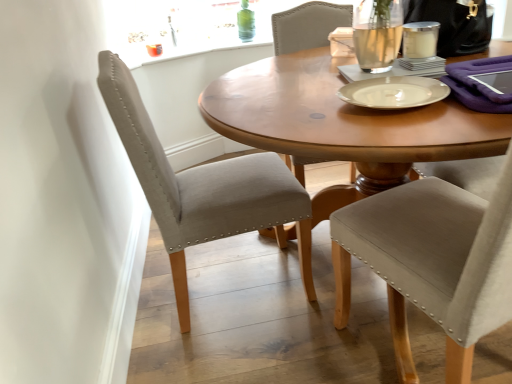
Question: Can we say white matte plate at center, placed as the first tableware when sorted from bottom to top, lies outside satin beige chair at left, which ranks as the 1th chair in left-to-right order?

Choices:
 (A) no
 (B) yes

Answer: (B)

Question: Is white matte plate at center, which ranks as the 2th tableware in top-to-bottom order, surrounding satin beige chair at left, which ranks as the 1th chair in left-to-right order?

Choices:
 (A) no
 (B) yes

Answer: (A)

Question: Is white matte plate at center, the first tableware viewed from the left, shorter than satin beige chair at left, the second chair viewed from the right?

Choices:
 (A) yes
 (B) no

Answer: (A)

Question: Can you confirm if white matte plate at center, placed as the first tableware when sorted from bottom to top, is wider than satin beige chair at left, the second chair viewed from the right?

Choices:
 (A) yes
 (B) no

Answer: (B)

Question: Considering the relative sizes of white matte plate at center, which is the second tableware from right to left, and satin beige chair at left, which ranks as the 1th chair in left-to-right order, in the image provided, is white matte plate at center, which is the second tableware from right to left, taller than satin beige chair at left, which ranks as the 1th chair in left-to-right order,?

Choices:
 (A) no
 (B) yes

Answer: (A)

Question: Is white matte plate at center, which is the second tableware in back-to-front order, bigger or smaller than satin beige chair at left, which ranks as the 1th chair in left-to-right order?

Choices:
 (A) big
 (B) small

Answer: (B)

Question: Is white matte plate at center, which is the second tableware from right to left, to the left or to the right of satin beige chair at left, the second chair viewed from the right, in the image?

Choices:
 (A) right
 (B) left

Answer: (A)

Question: Is white matte plate at center, placed as the first tableware when sorted from bottom to top, situated inside satin beige chair at left, which ranks as the 1th chair in left-to-right order, or outside?

Choices:
 (A) inside
 (B) outside

Answer: (B)

Question: Is white matte plate at center, the first tableware viewed from the left, wider or thinner than satin beige chair at left, the second chair viewed from the right?

Choices:
 (A) thin
 (B) wide

Answer: (A)

Question: Is point (403, 44) closer or farther from the camera than point (412, 104)?

Choices:
 (A) farther
 (B) closer

Answer: (A)

Question: From the image's perspective, is clear glass candle at upper right, the 1th tableware from the right, located above or below white matte plate at center, which is the second tableware from right to left?

Choices:
 (A) above
 (B) below

Answer: (A)

Question: Considering their positions, is clear glass candle at upper right, the first tableware in the top-to-bottom sequence, located in front of or behind white matte plate at center, the first tableware viewed from the left?

Choices:
 (A) front
 (B) behind

Answer: (B)

Question: From their relative heights in the image, would you say clear glass candle at upper right, the 1th tableware from the right, is taller or shorter than white matte plate at center, acting as the 1th tableware starting from the front?

Choices:
 (A) short
 (B) tall

Answer: (B)

Question: Considering the positions of point (500, 264) and point (280, 182), is point (500, 264) closer or farther from the camera than point (280, 182)?

Choices:
 (A) closer
 (B) farther

Answer: (A)

Question: Is satin beige chair at upper right, the second chair from the left, inside or outside of satin beige chair at left, which ranks as the 1th chair in left-to-right order?

Choices:
 (A) inside
 (B) outside

Answer: (B)